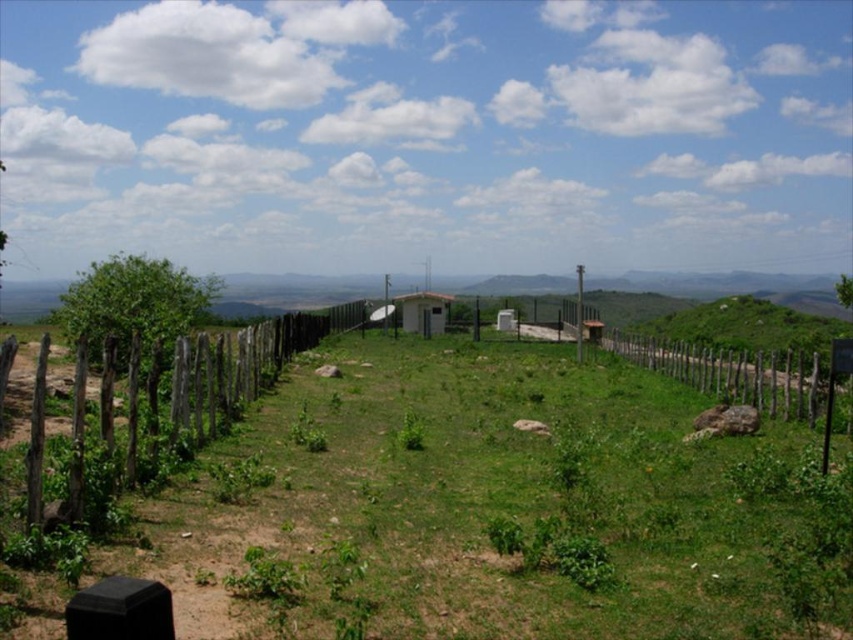
You are a gardener planning to plant a row of sunflowers in the green grassy field at center. Considering the height of the white matte hut at center, will the sunflowers grow taller than the hut if they reach their maximum height of 3 meters?

The green grassy field at center has a lesser height compared to the white matte hut at center. Since the sunflowers can grow up to 3 meters, but the hut is taller than the grassy field, it depends on the actual height of the hut. However, since the grass is shorter, the hut might be significantly taller, so the sunflowers might not surpass it. Without specific measurements, we can infer the hut is taller than the grass, but the sunflowers could potentially grow taller than the hut if the hut is under 3m.

You are a photographer standing in the middle of the green grassy field at center and want to take a picture of the brown wooden fence at left. Which object is closer to your current position?

The green grassy field at center is closer to the viewer than the brown wooden fence at left, so the photographer is already in the green grassy field at center and the brown wooden fence at left is further away.

You are standing at the wooden fence on the left side of the image and want to walk directly towards the small building in the center. There are two points marked on your path. Which point would you encounter first, point (281, 550) or point (215, 337)?

You would encounter point (281, 550) first because it is in front of point (215, 337) along your path towards the small building in the center.